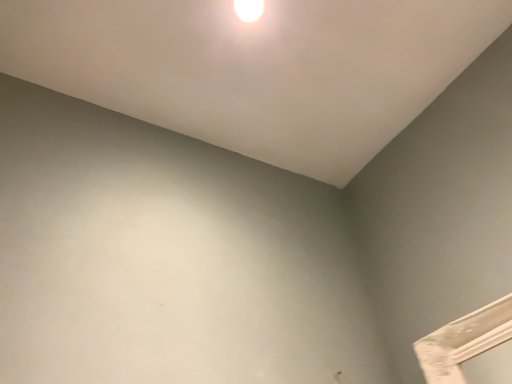
Locate an element on the screen. This screenshot has width=512, height=384. white glossy droplight at upper center is located at coordinates (249, 9).

This screenshot has width=512, height=384. Describe the element at coordinates (249, 9) in the screenshot. I see `white glossy droplight at upper center` at that location.

The image size is (512, 384). Identify the location of white glossy droplight at upper center. (249, 9).